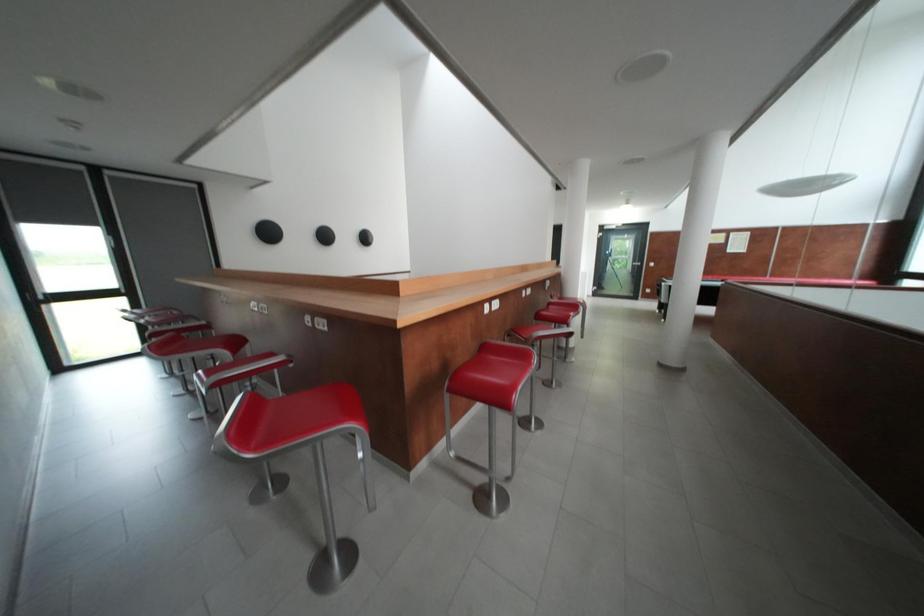
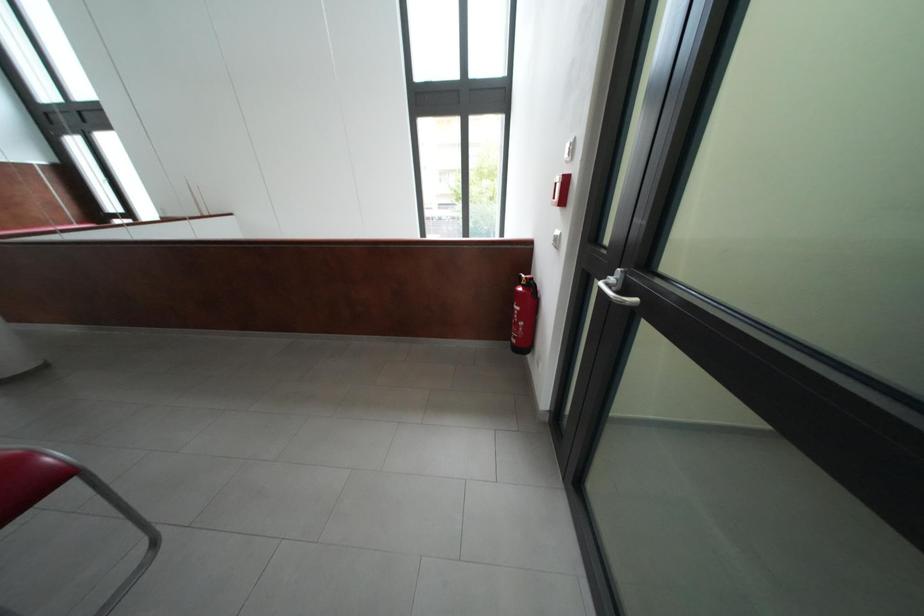
Based on the continuous images, in which direction is the camera rotating?

The rotation direction of the camera is right-down.